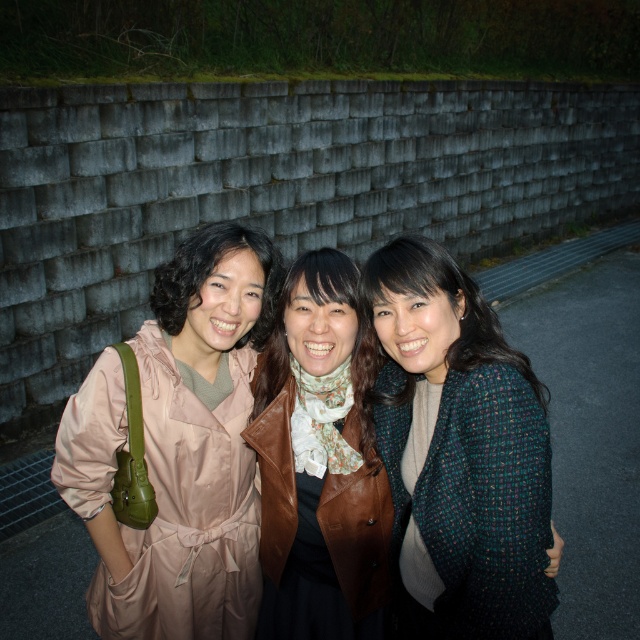
Question: Can you confirm if matte pink coat at left is positioned below green tweed jacket at center?

Choices:
 (A) no
 (B) yes

Answer: (B)

Question: Is matte pink coat at left below green tweed jacket at center?

Choices:
 (A) no
 (B) yes

Answer: (B)

Question: Which point is farther to the camera?

Choices:
 (A) green tweed jacket at center
 (B) matte pink coat at left
 (C) brown leather jacket at center

Answer: (B)

Question: Which is farther from the brown leather jacket at center?

Choices:
 (A) matte pink coat at left
 (B) green tweed jacket at center

Answer: (B)

Question: Is green tweed jacket at center to the right of brown leather jacket at center from the viewer's perspective?

Choices:
 (A) yes
 (B) no

Answer: (A)

Question: Which point is closer to the camera?

Choices:
 (A) green tweed jacket at center
 (B) brown leather jacket at center

Answer: (A)